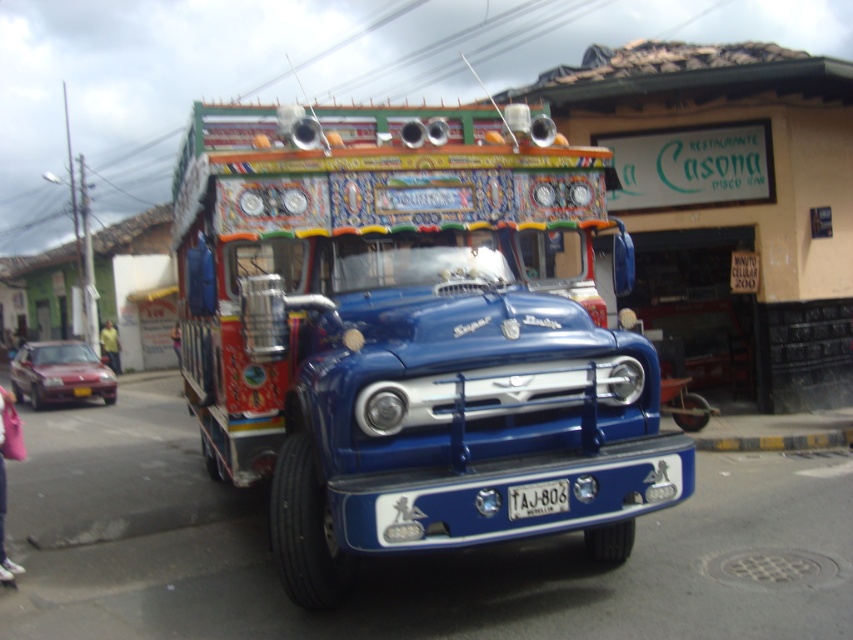
Is yellow concrete curb at lower center taller than white plastic license plate at center?

Correct, yellow concrete curb at lower center is much taller as white plastic license plate at center.

Based on the photo, between yellow concrete curb at lower center and white plastic license plate at center, which one is positioned higher?

Positioned higher is white plastic license plate at center.

Describe the element at coordinates (776, 442) in the screenshot. I see `yellow concrete curb at lower center` at that location.

You are a GUI agent. You are given a task and a screenshot of the screen. Output one action in this format:
    pyautogui.click(x=<x>, y=<y>)
    Task: Click on the yellow concrete curb at lower center
    The width and height of the screenshot is (853, 640).
    Given the screenshot: What is the action you would take?
    pyautogui.click(x=776, y=442)

Who is taller, shiny blue truck at center or white plastic license plate at center?

Standing taller between the two is shiny blue truck at center.

I want to click on shiny blue truck at center, so click(410, 332).

You are a GUI agent. You are given a task and a screenshot of the screen. Output one action in this format:
    pyautogui.click(x=<x>, y=<y>)
    Task: Click on the shiny blue truck at center
    This screenshot has height=640, width=853.
    Given the screenshot: What is the action you would take?
    pyautogui.click(x=410, y=332)

Does shiny blue truck at center have a lesser width compared to yellow concrete curb at lower center?

Correct, shiny blue truck at center's width is less than yellow concrete curb at lower center's.

Can you confirm if shiny blue truck at center is bigger than yellow concrete curb at lower center?

No, shiny blue truck at center is not bigger than yellow concrete curb at lower center.

Where is `shiny blue truck at center`? The height and width of the screenshot is (640, 853). shiny blue truck at center is located at coordinates (410, 332).